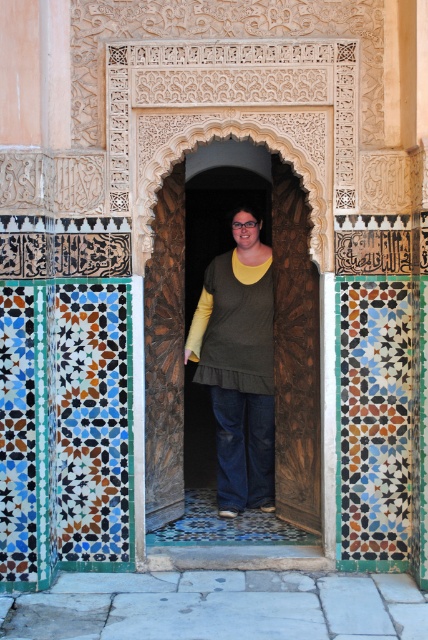
Can you confirm if wooden door at center is thinner than dark green fabric shirt at center?

In fact, wooden door at center might be wider than dark green fabric shirt at center.

Does wooden door at center have a greater height compared to dark green fabric shirt at center?

Indeed, wooden door at center has a greater height compared to dark green fabric shirt at center.

At what (x,y) coordinates should I click in order to perform the action: click on wooden door at center. Please return your answer as a coordinate pair (x, y). Looking at the image, I should click on (183, 323).